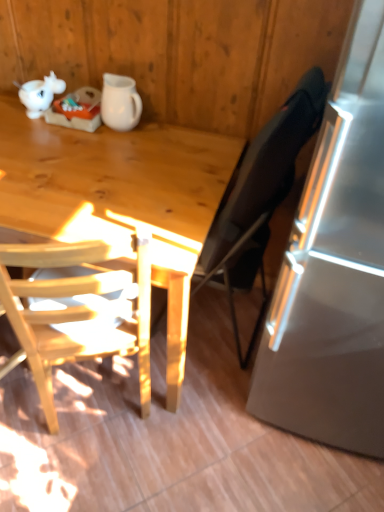
Measure the distance between point (277,199) and camera.

Point (277,199) and camera are 1.31 meters apart from each other.

The image size is (384, 512). Identify the location of white matte pitcher at upper center. (120, 102).

The height and width of the screenshot is (512, 384). Describe the element at coordinates (120, 196) in the screenshot. I see `light wood desk at left` at that location.

Image resolution: width=384 pixels, height=512 pixels. What are the coordinates of `light wood chair at left, arranged as the 2th chair when viewed from the right` in the screenshot? It's located at (77, 309).

Identify the location of the 2nd chair directly above the light wood desk at left (from a real-world perspective). (260, 197).

Is point (31, 219) farther from camera compared to point (244, 266)?

No.

From a real-world perspective, which object stands above the other?

From a 3D spatial view, black fabric chair at right, which is counted as the first chair, starting from the right, is above.

Would you say light wood desk at left is outside black fabric chair at right, which is counted as the first chair, starting from the right?

light wood desk at left lies outside black fabric chair at right, which is counted as the first chair, starting from the right,'s area.

Could you tell me if white matte pitcher at upper center is facing black fabric chair at right, the 2th chair viewed from the left?

No, white matte pitcher at upper center is not oriented towards black fabric chair at right, the 2th chair viewed from the left.

Which of these two, white matte pitcher at upper center or black fabric chair at right, which is counted as the first chair, starting from the right, is thinner?

white matte pitcher at upper center.

Between white matte pitcher at upper center and black fabric chair at right, which is counted as the first chair, starting from the right, which one is positioned in front?

black fabric chair at right, which is counted as the first chair, starting from the right, is more forward.

Considering the relative sizes of white matte pitcher at upper center and black fabric chair at right, which is counted as the first chair, starting from the right, in the image provided, is white matte pitcher at upper center taller than black fabric chair at right, which is counted as the first chair, starting from the right,?

In fact, white matte pitcher at upper center may be shorter than black fabric chair at right, which is counted as the first chair, starting from the right.

From the image's perspective, is light wood desk at left located beneath white matte pitcher at upper center?

Indeed, from the image's perspective, light wood desk at left is shown beneath white matte pitcher at upper center.

Which object is thinner, light wood desk at left or white matte pitcher at upper center?

white matte pitcher at upper center.

Does light wood desk at left come in front of white matte pitcher at upper center?

Yes, the depth of light wood desk at left is less than that of white matte pitcher at upper center.

Is light wood desk at left to the left of white matte pitcher at upper center from the viewer's perspective?

Correct, you'll find light wood desk at left to the left of white matte pitcher at upper center.

Considering the points (138, 291) and (107, 112), which point is behind, point (138, 291) or point (107, 112)?

Point (107, 112)

Does light wood chair at left, positioned as the 1th chair in left-to-right order, have a lesser height compared to white matte pitcher at upper center?

No.

How much distance is there between light wood chair at left, positioned as the 1th chair in left-to-right order, and white matte pitcher at upper center?

The distance of light wood chair at left, positioned as the 1th chair in left-to-right order, from white matte pitcher at upper center is 28.61 inches.

From the image's perspective, is light wood chair at left, positioned as the 1th chair in left-to-right order, on white matte pitcher at upper center?

No, from the image's perspective, light wood chair at left, positioned as the 1th chair in left-to-right order, is not above white matte pitcher at upper center.

From the image's perspective, is black fabric chair at right, the 2th chair viewed from the left, above white matte pitcher at upper center?

No, from the image's perspective, black fabric chair at right, the 2th chair viewed from the left, is not above white matte pitcher at upper center.

Which of these two, black fabric chair at right, which is counted as the first chair, starting from the right, or white matte pitcher at upper center, is bigger?

black fabric chair at right, which is counted as the first chair, starting from the right.

Is black fabric chair at right, the 2th chair viewed from the left, positioned with its back to white matte pitcher at upper center?

No, black fabric chair at right, the 2th chair viewed from the left, is not facing the opposite direction of white matte pitcher at upper center.

Image resolution: width=384 pixels, height=512 pixels. What are the coordinates of `pitcher to the left of black fabric chair at right, which is counted as the first chair, starting from the right` in the screenshot? It's located at (120, 102).

Considering the relative sizes of light wood chair at left, arranged as the 2th chair when viewed from the right, and black fabric chair at right, which is counted as the first chair, starting from the right, in the image provided, is light wood chair at left, arranged as the 2th chair when viewed from the right, taller than black fabric chair at right, which is counted as the first chair, starting from the right,?

Indeed, light wood chair at left, arranged as the 2th chair when viewed from the right, has a greater height compared to black fabric chair at right, which is counted as the first chair, starting from the right.

Can you tell me how much light wood chair at left, arranged as the 2th chair when viewed from the right, and black fabric chair at right, the 2th chair viewed from the left, differ in facing direction?

They differ by 50.6 degrees in their facing directions.

Considering the relative sizes of light wood chair at left, positioned as the 1th chair in left-to-right order, and black fabric chair at right, which is counted as the first chair, starting from the right, in the image provided, is light wood chair at left, positioned as the 1th chair in left-to-right order, bigger than black fabric chair at right, which is counted as the first chair, starting from the right,?

Indeed, light wood chair at left, positioned as the 1th chair in left-to-right order, has a larger size compared to black fabric chair at right, which is counted as the first chair, starting from the right.

Considering the sizes of black fabric chair at right, which is counted as the first chair, starting from the right, and light wood chair at left, positioned as the 1th chair in left-to-right order, in the image, is black fabric chair at right, which is counted as the first chair, starting from the right, bigger or smaller than light wood chair at left, positioned as the 1th chair in left-to-right order,?

Considering their sizes, black fabric chair at right, which is counted as the first chair, starting from the right, takes up less space than light wood chair at left, positioned as the 1th chair in left-to-right order.

How many degrees apart are the facing directions of black fabric chair at right, which is counted as the first chair, starting from the right, and light wood chair at left, arranged as the 2th chair when viewed from the right?

The angular difference between black fabric chair at right, which is counted as the first chair, starting from the right, and light wood chair at left, arranged as the 2th chair when viewed from the right, is 50.6 degrees.

From the image's perspective, which one is positioned lower, black fabric chair at right, the 2th chair viewed from the left, or light wood chair at left, arranged as the 2th chair when viewed from the right?

From the image's view, light wood chair at left, arranged as the 2th chair when viewed from the right, is below.

In the scene shown: From a real-world perspective, is black fabric chair at right, the 2th chair viewed from the left, located beneath light wood chair at left, arranged as the 2th chair when viewed from the right?

No, from a real-world perspective, black fabric chair at right, the 2th chair viewed from the left, is not below light wood chair at left, arranged as the 2th chair when viewed from the right.

In order to click on chair that is the 2nd one above the light wood desk at left (from a real-world perspective) in this screenshot , I will do `click(260, 197)`.

Where is `pitcher on the left of black fabric chair at right, which is counted as the first chair, starting from the right`? The image size is (384, 512). pitcher on the left of black fabric chair at right, which is counted as the first chair, starting from the right is located at coordinates (120, 102).

Estimate the real-world distances between objects in this image. Which object is closer to white matte pitcher at upper center, light wood chair at left, positioned as the 1th chair in left-to-right order, or light wood desk at left?

light wood desk at left is closer to white matte pitcher at upper center.

Looking at this image, looking at the image, which one is located further to light wood chair at left, positioned as the 1th chair in left-to-right order, light wood desk at left or white matte pitcher at upper center?

white matte pitcher at upper center is further to light wood chair at left, positioned as the 1th chair in left-to-right order.

Estimate the real-world distances between objects in this image. Which object is further from light wood chair at left, positioned as the 1th chair in left-to-right order, white matte pitcher at upper center or light wood desk at left?

white matte pitcher at upper center is positioned further to the anchor light wood chair at left, positioned as the 1th chair in left-to-right order.

When comparing their distances from black fabric chair at right, which is counted as the first chair, starting from the right, does white matte pitcher at upper center or light wood chair at left, positioned as the 1th chair in left-to-right order, seem closer?

light wood chair at left, positioned as the 1th chair in left-to-right order, is positioned closer to the anchor black fabric chair at right, which is counted as the first chair, starting from the right.

Considering their positions, is black fabric chair at right, the 2th chair viewed from the left, positioned closer to white matte pitcher at upper center than light wood chair at left, positioned as the 1th chair in left-to-right order?

black fabric chair at right, the 2th chair viewed from the left, is closer to white matte pitcher at upper center.

Which object lies nearer to the anchor point light wood desk at left, white matte pitcher at upper center or light wood chair at left, positioned as the 1th chair in left-to-right order?

light wood chair at left, positioned as the 1th chair in left-to-right order, is positioned closer to the anchor light wood desk at left.

Looking at the image, which one is located closer to light wood desk at left, white matte pitcher at upper center or black fabric chair at right, which is counted as the first chair, starting from the right?

The object closer to light wood desk at left is white matte pitcher at upper center.

Consider the image. From the image, which object appears to be nearer to black fabric chair at right, which is counted as the first chair, starting from the right, light wood chair at left, positioned as the 1th chair in left-to-right order, or white matte pitcher at upper center?

light wood chair at left, positioned as the 1th chair in left-to-right order, is positioned closer to the anchor black fabric chair at right, which is counted as the first chair, starting from the right.

Locate an element on the screen. desk that lies between white matte pitcher at upper center and light wood chair at left, arranged as the 2th chair when viewed from the right, from top to bottom is located at coordinates (120, 196).

Find the location of a particular element. pitcher situated between light wood desk at left and black fabric chair at right, which is counted as the first chair, starting from the right, from left to right is located at coordinates (120, 102).

Where is `chair between light wood desk at left and black fabric chair at right, the 2th chair viewed from the left`? This screenshot has width=384, height=512. chair between light wood desk at left and black fabric chair at right, the 2th chair viewed from the left is located at coordinates (77, 309).

Identify the location of chair between white matte pitcher at upper center and light wood chair at left, arranged as the 2th chair when viewed from the right, vertically. tap(260, 197).